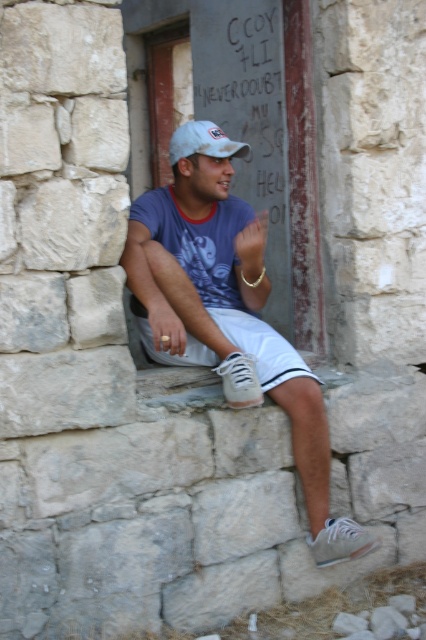
You are standing at the point closest to the man in the image. Which of the two points, point (x=227, y=323) or point (x=279, y=72), is closer to you?

Point (x=227, y=323) is closer to you because it is in front of point (x=279, y=72).

You are a photographer trying to capture a candid shot of the man while ensuring both the white matte sneakers at lower center and the white cotton shorts at center are visible. Given their sizes, which object should you focus on to ensure both are in frame without zooming in or out?

The white matte sneakers at lower center is larger in size than the white cotton shorts at center, so focusing on the white matte sneakers at lower center will ensure both are visible without needing to adjust the zoom.